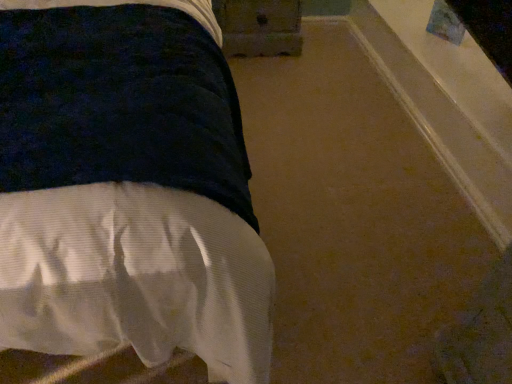
Where is `empty space that is to the right of wooden drawer at upper center`? The image size is (512, 384). empty space that is to the right of wooden drawer at upper center is located at coordinates (323, 63).